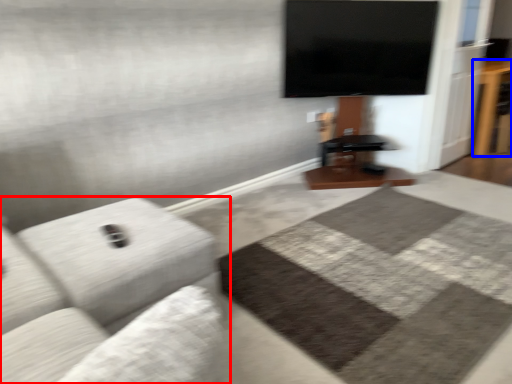
Question: Among these objects, which one is nearest to the camera, studio couch (highlighted by a red box) or table (highlighted by a blue box)?

Choices:
 (A) studio couch
 (B) table

Answer: (A)